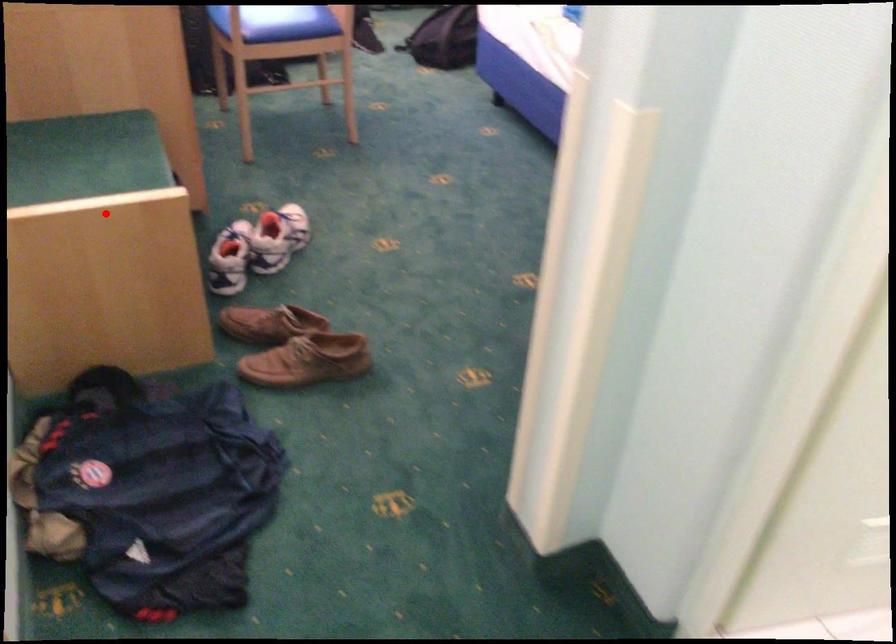
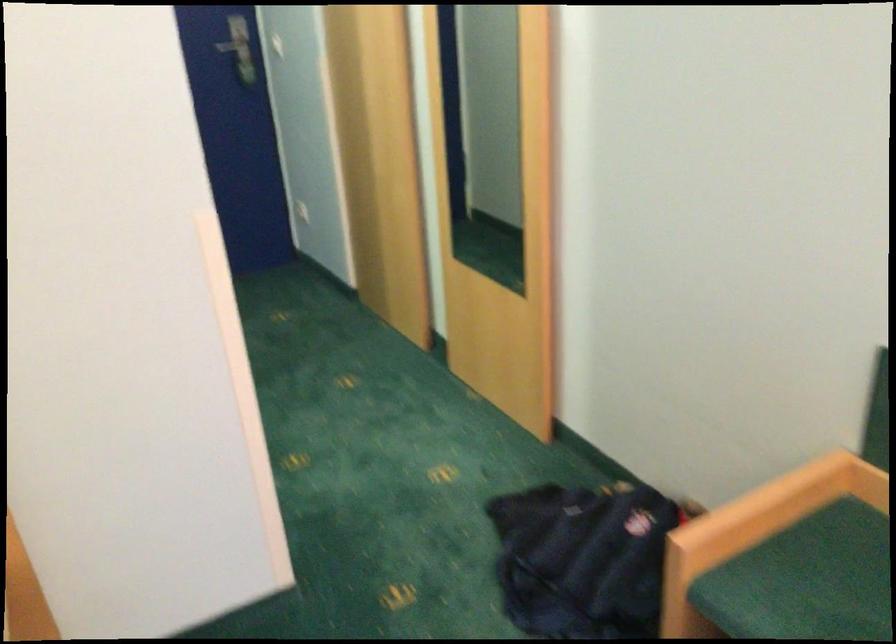
Locate, in the second image, the point that corresponds to the highlighted location in the first image.

(756, 529)